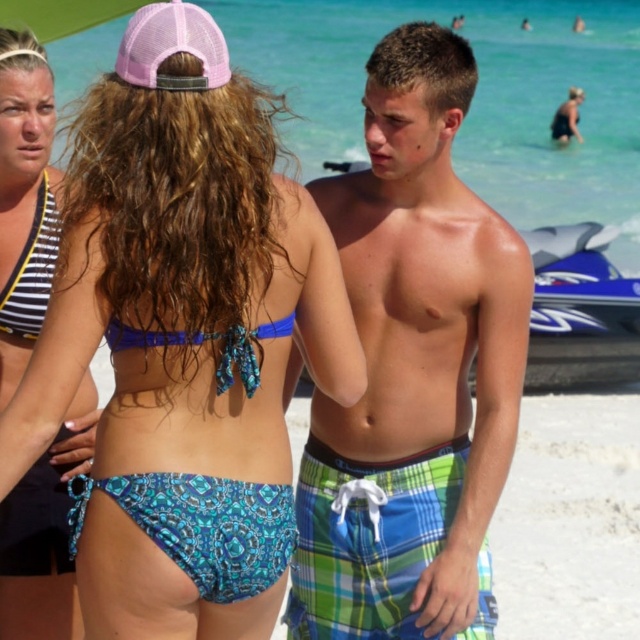
You are a photographer on the beach and want to capture a photo of the blue printed bikini bottom at center and the striped fabric bikini top at upper left. Which one is closer to the camera?

The blue printed bikini bottom at center is closer to the camera because it is in front of the striped fabric bikini top at upper left.

You are standing at the point marked by the coordinates point (264, 150) and want to walk directly towards the viewer. How far will you have to walk to reach them?

The distance between point (264, 150) and the viewer is 10.14 feet, so you will have to walk 10.14 feet to reach them.